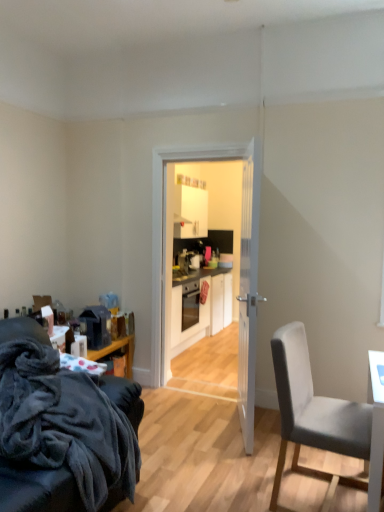
At what (x,y) coordinates should I click in order to perform the action: click on free spot above white glossy door at center (from a real-world perspective). Please return your answer as a coordinate pair (x, y). Looking at the image, I should click on (203, 138).